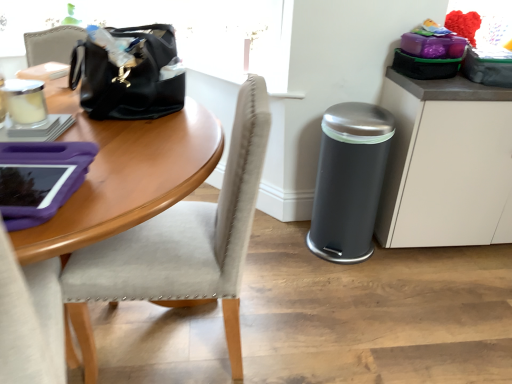
Find the location of a particular element. The image size is (512, 384). matte gray cabinet at right is located at coordinates (445, 163).

Find the location of a particular element. black leather handbag at upper left is located at coordinates (128, 73).

The height and width of the screenshot is (384, 512). Find the location of `light gray fabric chair at left`. light gray fabric chair at left is located at coordinates (182, 242).

Find the location of a particular element. This screenshot has height=384, width=512. matte gray cabinet at right is located at coordinates (445, 163).

Is black leather handbag at upper left far from light gray fabric chair at left?

They are positioned close to each other.

Is black leather handbag at upper left wider than light gray fabric chair at left?

No, black leather handbag at upper left is not wider than light gray fabric chair at left.

The height and width of the screenshot is (384, 512). What are the coordinates of `handbag behind the light gray fabric chair at left` in the screenshot? It's located at (128, 73).

Is black leather handbag at upper left facing towards light gray fabric chair at left?

No, black leather handbag at upper left is not facing towards light gray fabric chair at left.

Is light gray fabric chair at left turned away from black leather handbag at upper left?

That's not correct — light gray fabric chair at left is not looking away from black leather handbag at upper left.

In the scene shown: Is light gray fabric chair at left completely or partially outside of black leather handbag at upper left?

Indeed, light gray fabric chair at left is completely outside black leather handbag at upper left.

From a real-world perspective, is light gray fabric chair at left positioned under black leather handbag at upper left based on gravity?

Yes, from a real-world perspective, light gray fabric chair at left is beneath black leather handbag at upper left.

Does point (490, 110) come closer to viewer compared to point (134, 229)?

No, it is not.

Image resolution: width=512 pixels, height=384 pixels. I want to click on chair located below the matte gray cabinet at right (from the image's perspective), so click(x=182, y=242).

Is matte gray cabinet at right closer to the viewer compared to light gray fabric chair at left?

No, it is not.

Is matte gray cabinet at right at the left side of light gray fabric chair at left?

No, matte gray cabinet at right is not to the left of light gray fabric chair at left.

Which point is more forward, (x=392, y=220) or (x=131, y=117)?

The point (x=131, y=117) is closer to the camera.

Is the depth of matte gray cabinet at right less than that of black leather handbag at upper left?

No, it is behind black leather handbag at upper left.

From the image's perspective, is matte gray cabinet at right positioned above or below black leather handbag at upper left?

Based on their image positions, matte gray cabinet at right is located beneath black leather handbag at upper left.

What's the angular difference between matte gray cabinet at right and black leather handbag at upper left's facing directions?

There is a 97.7-degree angle between the facing directions of matte gray cabinet at right and black leather handbag at upper left.

Does light gray fabric chair at left come behind matte gray cabinet at right?

No, it is not.

Which of these two, light gray fabric chair at left or matte gray cabinet at right, is thinner?

matte gray cabinet at right is thinner.

From the image's perspective, is light gray fabric chair at left beneath matte gray cabinet at right?

Indeed, from the image's perspective, light gray fabric chair at left is shown beneath matte gray cabinet at right.

Can you confirm if black leather handbag at upper left is thinner than matte gray cabinet at right?

Yes, black leather handbag at upper left is thinner than matte gray cabinet at right.

From the image's perspective, is black leather handbag at upper left located above or below matte gray cabinet at right?

From the image's perspective, black leather handbag at upper left appears above matte gray cabinet at right.

The image size is (512, 384). In the image, there is a black leather handbag at upper left. In order to click on cabinetry below it (from a real-world perspective) in this screenshot , I will do `click(445, 163)`.

How far apart are black leather handbag at upper left and matte gray cabinet at right?

black leather handbag at upper left is 1.13 meters from matte gray cabinet at right.

Locate an element on the screen. This screenshot has width=512, height=384. chair to the right of black leather handbag at upper left is located at coordinates (182, 242).

You are a GUI agent. You are given a task and a screenshot of the screen. Output one action in this format:
    pyautogui.click(x=<x>, y=<y>)
    Task: Click on the chair below the black leather handbag at upper left (from a real-world perspective)
    Image resolution: width=512 pixels, height=384 pixels.
    Given the screenshot: What is the action you would take?
    pyautogui.click(x=182, y=242)

Based on their spatial positions, is light gray fabric chair at left or matte gray cabinet at right closer to black leather handbag at upper left?

light gray fabric chair at left is closer to black leather handbag at upper left.

From the image, which object appears to be farther from matte gray cabinet at right, light gray fabric chair at left or black leather handbag at upper left?

black leather handbag at upper left lies further to matte gray cabinet at right than the other object.

When comparing their distances from black leather handbag at upper left, does matte gray cabinet at right or light gray fabric chair at left seem further?

matte gray cabinet at right.

Considering their positions, is black leather handbag at upper left positioned closer to matte gray cabinet at right than light gray fabric chair at left?

light gray fabric chair at left lies closer to matte gray cabinet at right than the other object.

Considering their positions, is black leather handbag at upper left positioned closer to light gray fabric chair at left than matte gray cabinet at right?

The object closer to light gray fabric chair at left is black leather handbag at upper left.

Considering their positions, is matte gray cabinet at right positioned closer to light gray fabric chair at left than black leather handbag at upper left?

black leather handbag at upper left lies closer to light gray fabric chair at left than the other object.

Find the location of a particular element. The height and width of the screenshot is (384, 512). chair between black leather handbag at upper left and matte gray cabinet at right is located at coordinates (182, 242).